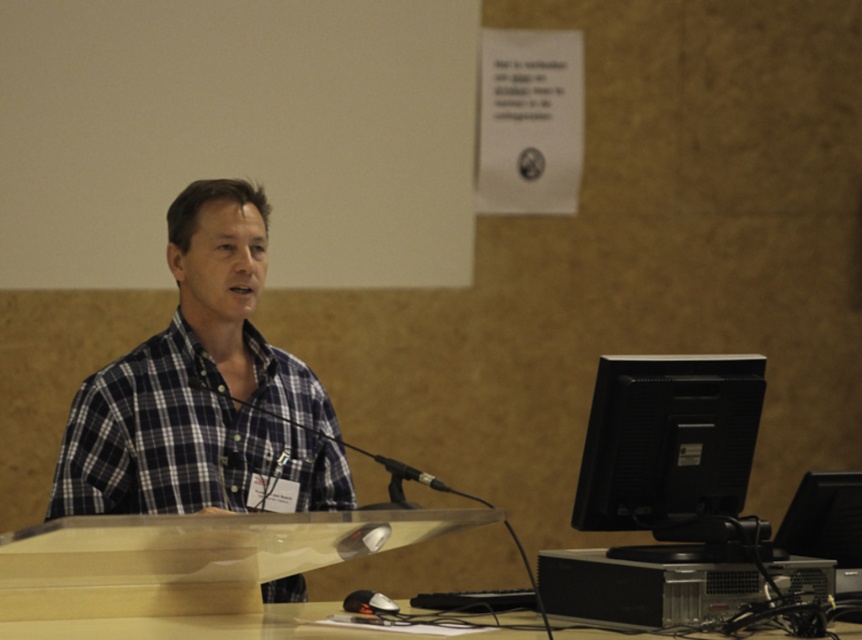
Question: Among these objects, which one is nearest to the camera?

Choices:
 (A) black matte microphone at center
 (B) clear plastic table at center
 (C) black matte monitor at right
 (D) wooden table at lower center

Answer: (B)

Question: Considering the real-world distances, which object is farthest from the clear plastic table at center?

Choices:
 (A) plaid cotton shirt at center
 (B) black matte monitor at right
 (C) wooden table at lower center
 (D) black matte microphone at center

Answer: (A)

Question: Observing the image, what is the correct spatial positioning of plaid cotton shirt at center in reference to black matte microphone at center?

Choices:
 (A) right
 (B) left

Answer: (B)

Question: Considering the real-world distances, which object is farthest from the clear plastic table at center?

Choices:
 (A) wooden table at lower center
 (B) black matte monitor at right

Answer: (B)

Question: Can you confirm if wooden table at lower center is thinner than black matte microphone at center?

Choices:
 (A) yes
 (B) no

Answer: (B)

Question: Does wooden table at lower center lie behind black matte microphone at center?

Choices:
 (A) yes
 (B) no

Answer: (B)